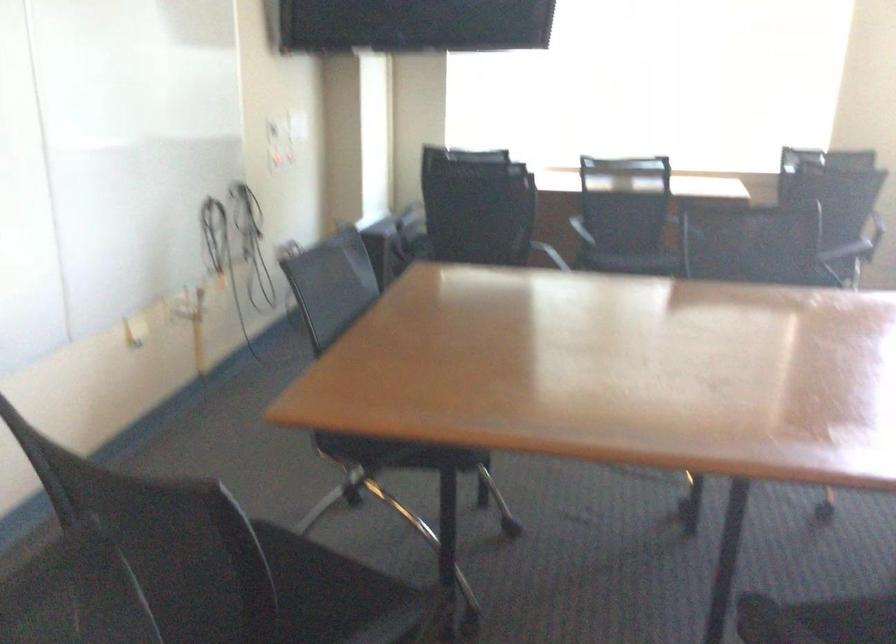
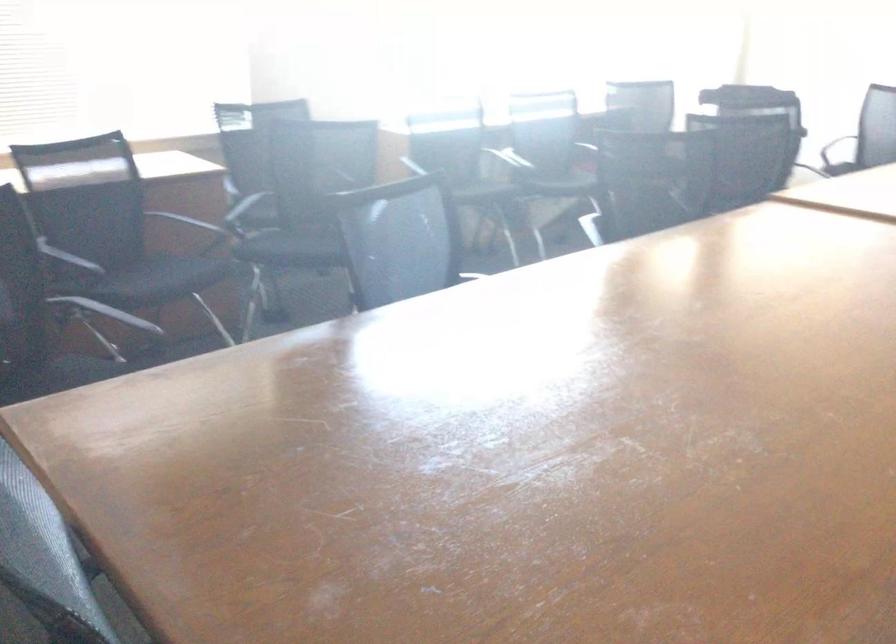
Locate, in the second image, the point that corresponds to [642,259] in the first image.

(159, 279)